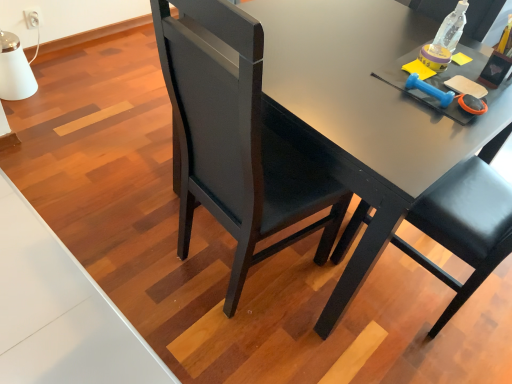
You are a GUI agent. You are given a task and a screenshot of the screen. Output one action in this format:
    pyautogui.click(x=<x>, y=<y>)
    Task: Click on the vacant region to the right of clear plastic bottle at upper right
    This screenshot has width=512, height=384.
    Given the screenshot: What is the action you would take?
    pyautogui.click(x=468, y=52)